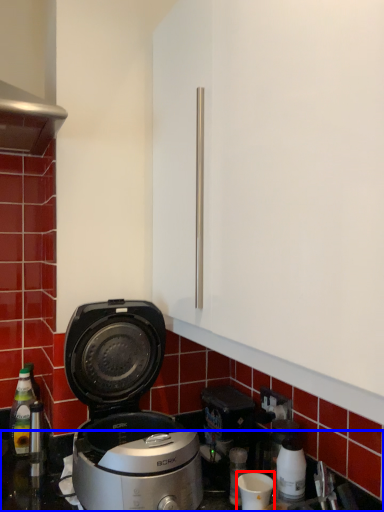
Question: Which object appears closest to the camera in this image, appliance (highlighted by a red box) or counter top (highlighted by a blue box)?

Choices:
 (A) appliance
 (B) counter top

Answer: (B)